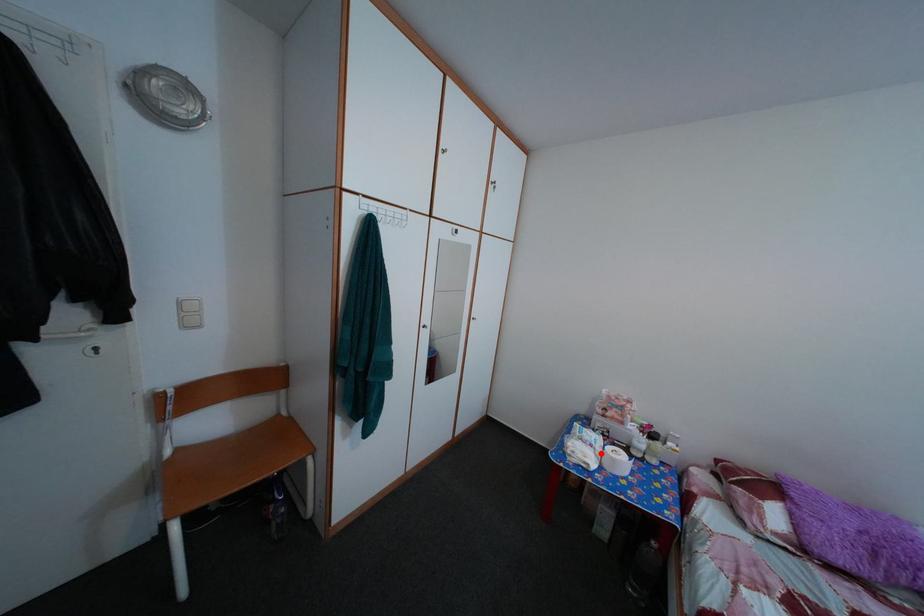
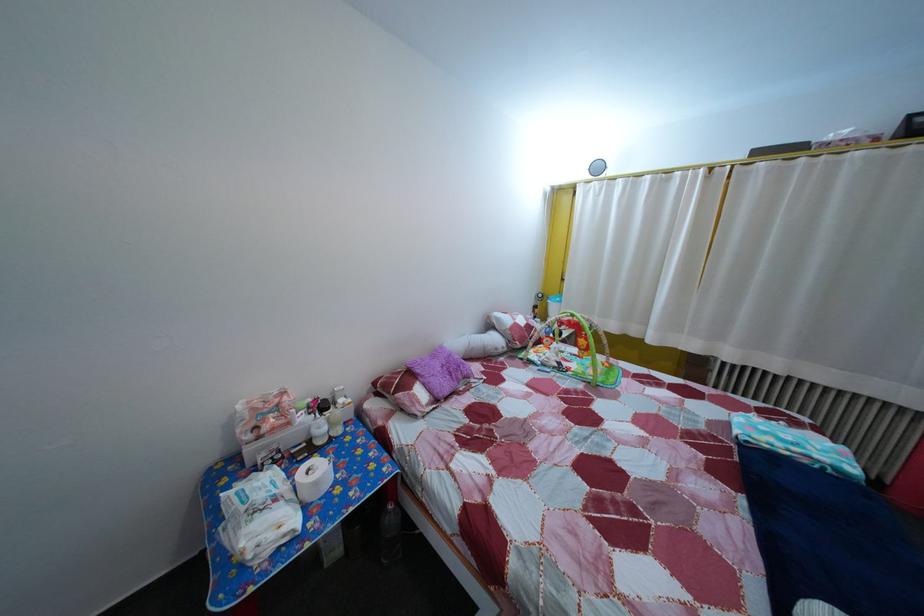
Question: I am providing you with two images of the same scene from different viewpoints. A red point is marked on the first image. Is the red point's position out of view in image 2?

Choices:
 (A) Yes
 (B) No

Answer: (B)